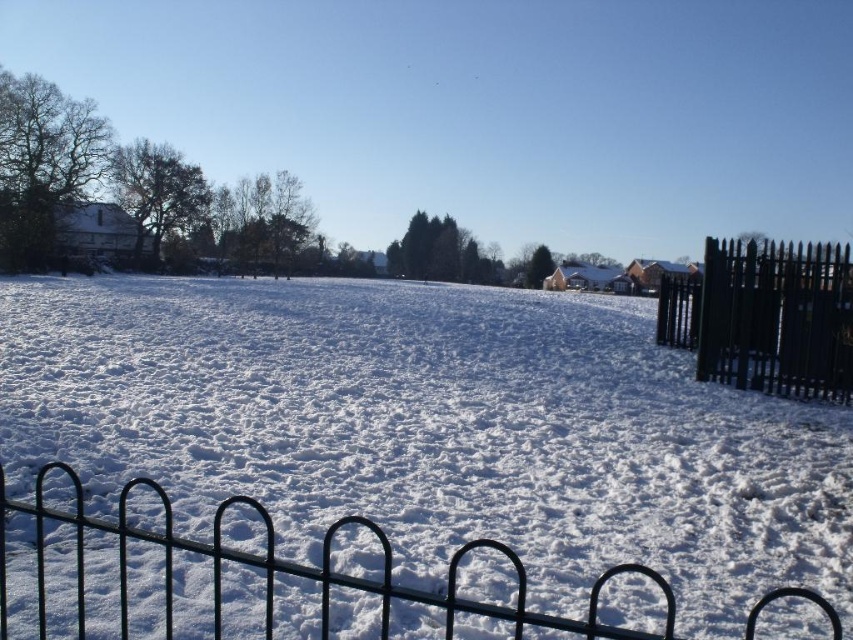
Can you confirm if white fluffy snow at center is positioned to the right of black metal fence at right?

Incorrect, white fluffy snow at center is not on the right side of black metal fence at right.

This screenshot has width=853, height=640. Find the location of `white fluffy snow at center`. white fluffy snow at center is located at coordinates [x=433, y=426].

This screenshot has height=640, width=853. Find the location of `white fluffy snow at center`. white fluffy snow at center is located at coordinates (433, 426).

Can you confirm if white fluffy snow at center is taller than black metal fence at lower center?

Yes.

You are a GUI agent. You are given a task and a screenshot of the screen. Output one action in this format:
    pyautogui.click(x=<x>, y=<y>)
    Task: Click on the white fluffy snow at center
    
    Given the screenshot: What is the action you would take?
    pyautogui.click(x=433, y=426)

Identify the location of white fluffy snow at center. Image resolution: width=853 pixels, height=640 pixels. (433, 426).

Who is positioned more to the left, black metal fence at right or black metal fence at lower center?

black metal fence at lower center is more to the left.

Is black metal fence at right further to camera compared to black metal fence at lower center?

Yes, black metal fence at right is behind black metal fence at lower center.

What do you see at coordinates (764, 317) in the screenshot? I see `black metal fence at right` at bounding box center [764, 317].

You are a GUI agent. You are given a task and a screenshot of the screen. Output one action in this format:
    pyautogui.click(x=<x>, y=<y>)
    Task: Click on the black metal fence at right
    This screenshot has height=640, width=853.
    Given the screenshot: What is the action you would take?
    pyautogui.click(x=764, y=317)